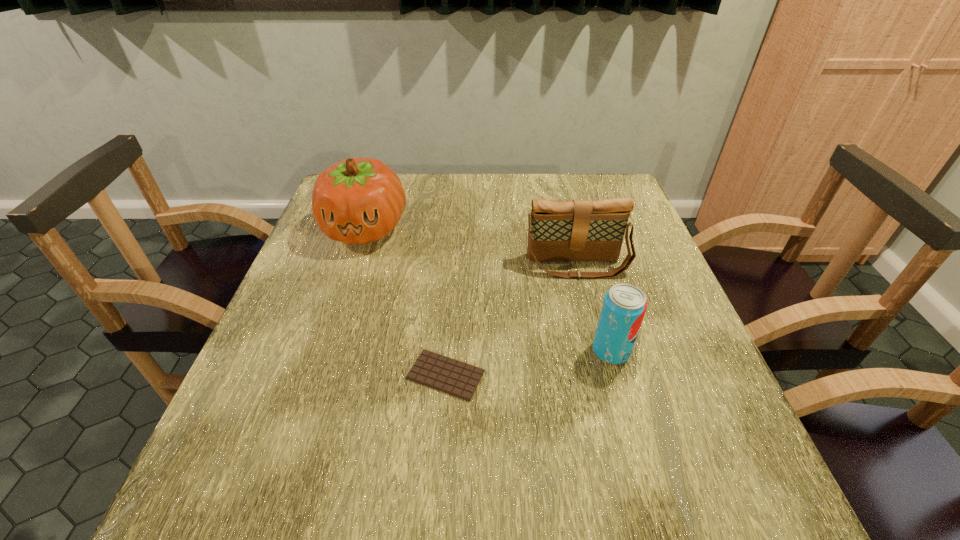
Where is `vacant point located between the second object from left to right and the pumpkin`? The image size is (960, 540). vacant point located between the second object from left to right and the pumpkin is located at coordinates (405, 302).

Find the location of `vacant space that is in between the pumpkin and the shoulder bag`. vacant space that is in between the pumpkin and the shoulder bag is located at coordinates (471, 247).

The image size is (960, 540). What are the coordinates of `free point between the shoulder bag and the soda can` in the screenshot? It's located at (593, 308).

At what (x,y) coordinates should I click in order to perform the action: click on free space between the shoulder bag and the soda can. Please return your answer as a coordinate pair (x, y). Looking at the image, I should click on (593, 308).

Find the location of a particular element. free space between the soda can and the tallest object is located at coordinates tap(488, 289).

Where is `free space between the pumpkin and the soda can`? The image size is (960, 540). free space between the pumpkin and the soda can is located at coordinates (488, 289).

Locate an element on the screen. The height and width of the screenshot is (540, 960). vacant area that lies between the shoulder bag and the soda can is located at coordinates (593, 308).

You are a GUI agent. You are given a task and a screenshot of the screen. Output one action in this format:
    pyautogui.click(x=<x>, y=<y>)
    Task: Click on the vacant space that's between the soda can and the chocolate bar
    The height and width of the screenshot is (540, 960).
    Given the screenshot: What is the action you would take?
    pyautogui.click(x=528, y=363)

The height and width of the screenshot is (540, 960). I want to click on free space between the pumpkin and the soda can, so click(488, 289).

Where is `free space between the soda can and the shoulder bag`? Image resolution: width=960 pixels, height=540 pixels. free space between the soda can and the shoulder bag is located at coordinates (593, 308).